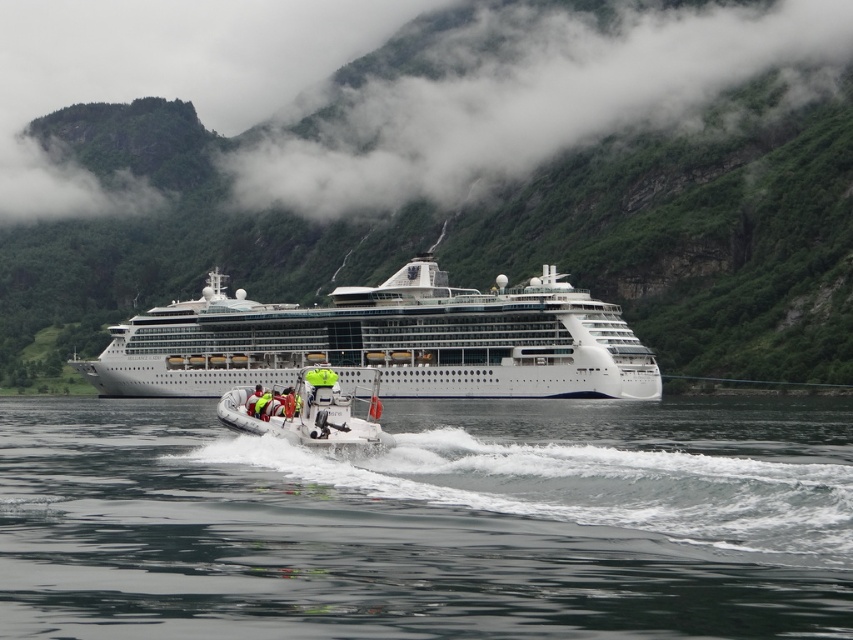
Does clear water at center have a lesser height compared to white glossy cruise ship at center?

Yes, clear water at center is shorter than white glossy cruise ship at center.

Can you confirm if clear water at center is smaller than white glossy cruise ship at center?

Correct, clear water at center occupies less space than white glossy cruise ship at center.

Does point (440, 609) come closer to viewer compared to point (509, 360)?

Yes, it is.

What are the coordinates of `clear water at center` in the screenshot? It's located at (428, 522).

Is clear water at center to the left of white rubber dinghy at center from the viewer's perspective?

In fact, clear water at center is to the right of white rubber dinghy at center.

Does clear water at center have a larger size compared to white rubber dinghy at center?

Indeed, clear water at center has a larger size compared to white rubber dinghy at center.

The image size is (853, 640). I want to click on clear water at center, so click(x=428, y=522).

This screenshot has width=853, height=640. In order to click on clear water at center in this screenshot , I will do `click(428, 522)`.

Who is more distant from viewer, (439, 353) or (332, 372)?

Positioned behind is point (439, 353).

Does white glossy cruise ship at center appear under white rubber dinghy at center?

Incorrect, white glossy cruise ship at center is not positioned below white rubber dinghy at center.

Looking at this image, measure the distance between point (212,385) and camera.

Point (212,385) is 460.25 feet away from camera.

Find the location of a particular element. white glossy cruise ship at center is located at coordinates (386, 340).